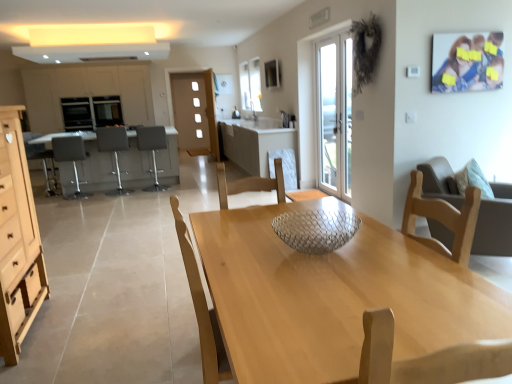
Question: From the image's perspective, is white glossy exhaust hood at upper center under light wood/wooden chair at right, the fifth chair positioned from the back?

Choices:
 (A) yes
 (B) no

Answer: (B)

Question: Does white glossy exhaust hood at upper center have a larger size compared to light wood/wooden chair at right, placed as the fifth chair when sorted from left to right?

Choices:
 (A) yes
 (B) no

Answer: (A)

Question: From a real-world perspective, is white glossy exhaust hood at upper center on light wood/wooden chair at right, the fifth chair positioned from the back?

Choices:
 (A) yes
 (B) no

Answer: (A)

Question: Is white glossy exhaust hood at upper center behind light wood/wooden chair at right, which is the 1th chair in right-to-left order?

Choices:
 (A) no
 (B) yes

Answer: (B)

Question: Does white glossy exhaust hood at upper center appear on the right side of light wood/wooden chair at right, marked as the 1th chair in a front-to-back arrangement?

Choices:
 (A) yes
 (B) no

Answer: (B)

Question: Can you confirm if white glossy exhaust hood at upper center is shorter than light wood/wooden chair at right, which is the 1th chair in right-to-left order?

Choices:
 (A) yes
 (B) no

Answer: (A)

Question: From a real-world perspective, is clear glass bowl at center below gray fabric bar stool at left, which is the 2th chair from front to back?

Choices:
 (A) yes
 (B) no

Answer: (B)

Question: Is clear glass bowl at center oriented towards gray fabric bar stool at left, which is counted as the fourth chair, starting from the back?

Choices:
 (A) yes
 (B) no

Answer: (B)

Question: Is clear glass bowl at center to the left of gray fabric bar stool at left, which is the 2th chair from front to back, from the viewer's perspective?

Choices:
 (A) yes
 (B) no

Answer: (B)

Question: From a real-world perspective, is clear glass bowl at center on gray fabric bar stool at left, which is counted as the fourth chair, starting from the back?

Choices:
 (A) yes
 (B) no

Answer: (A)

Question: From the image's perspective, does clear glass bowl at center appear lower than gray fabric bar stool at left, which is counted as the fourth chair, starting from the back?

Choices:
 (A) yes
 (B) no

Answer: (A)

Question: Is clear glass bowl at center closer to camera compared to gray fabric bar stool at left, which is the 2th chair from front to back?

Choices:
 (A) yes
 (B) no

Answer: (A)

Question: Is light wood table at center wider than gray fabric bar stool at left, the second chair from the left?

Choices:
 (A) yes
 (B) no

Answer: (A)